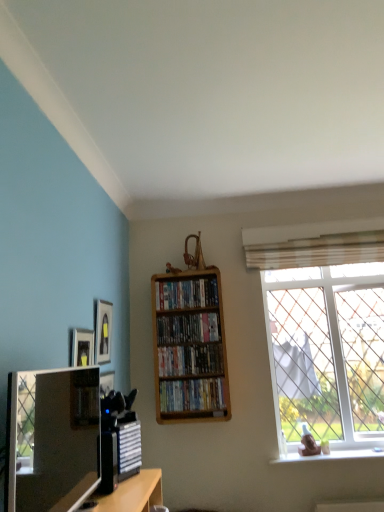
Question: Does satin black tv at lower left appear on the left side of matte black picture frame at upper left?

Choices:
 (A) yes
 (B) no

Answer: (B)

Question: Is satin black tv at lower left placed right next to matte black picture frame at upper left?

Choices:
 (A) no
 (B) yes

Answer: (A)

Question: Is matte black picture frame at upper left located within satin black tv at lower left?

Choices:
 (A) no
 (B) yes

Answer: (A)

Question: Is satin black tv at lower left at the right side of matte black picture frame at upper left?

Choices:
 (A) yes
 (B) no

Answer: (A)

Question: Does satin black tv at lower left have a lesser width compared to matte black picture frame at upper left?

Choices:
 (A) yes
 (B) no

Answer: (B)

Question: From the image's perspective, is satin black tv at lower left under matte black picture frame at upper left?

Choices:
 (A) yes
 (B) no

Answer: (A)

Question: Does wooden bookcase at center turn towards matte plastic dvds at center, the second book viewed from the top?

Choices:
 (A) yes
 (B) no

Answer: (A)

Question: Can you confirm if wooden bookcase at center is thinner than matte plastic dvds at center, the second book viewed from the top?

Choices:
 (A) yes
 (B) no

Answer: (A)

Question: Is wooden bookcase at center closer to camera compared to matte plastic dvds at center, the second book viewed from the top?

Choices:
 (A) no
 (B) yes

Answer: (B)

Question: Is wooden bookcase at center to the left of matte plastic dvds at center, arranged as the 3th book when ordered from the bottom, from the viewer's perspective?

Choices:
 (A) yes
 (B) no

Answer: (B)

Question: Can you confirm if wooden bookcase at center is taller than matte plastic dvds at center, the second book viewed from the top?

Choices:
 (A) no
 (B) yes

Answer: (B)

Question: From a real-world perspective, is wooden bookcase at center on matte plastic dvds at center, the second book viewed from the top?

Choices:
 (A) no
 (B) yes

Answer: (A)

Question: Considering the relative positions of wooden bookcase at center and matte black picture frame at upper left in the image provided, is wooden bookcase at center in front of matte black picture frame at upper left?

Choices:
 (A) yes
 (B) no

Answer: (B)